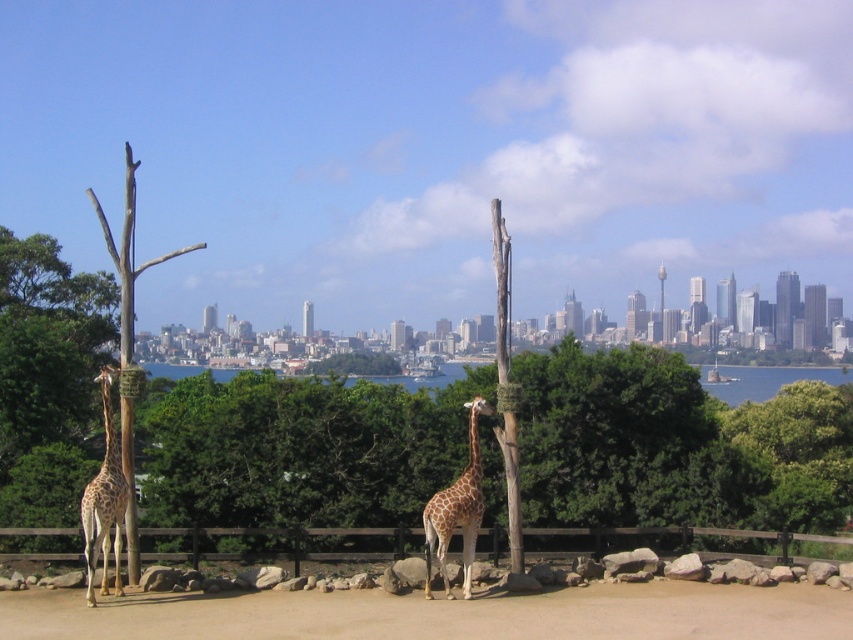
Between brown sandy dirt at center and spotted brown giraffe at center, which one has more height?

With more height is spotted brown giraffe at center.

Which is more to the right, brown sandy dirt at center or spotted brown giraffe at center?

spotted brown giraffe at center

Describe the element at coordinates (442, 614) in the screenshot. I see `brown sandy dirt at center` at that location.

Image resolution: width=853 pixels, height=640 pixels. What are the coordinates of `brown sandy dirt at center` in the screenshot? It's located at [442, 614].

Which is above, spotted fur giraffe at left or spotted brown giraffe at center?

spotted fur giraffe at left is higher up.

Does spotted fur giraffe at left come in front of spotted brown giraffe at center?

Yes, it is.

Identify the location of spotted fur giraffe at left. This screenshot has width=853, height=640. (103, 500).

Does brown sandy dirt at center have a greater height compared to brown wooden fence at center?

No.

Does brown sandy dirt at center have a greater width compared to brown wooden fence at center?

Incorrect, brown sandy dirt at center's width does not surpass brown wooden fence at center's.

Between point (212, 602) and point (206, 556), which one is positioned in front?

Point (212, 602) is more forward.

What are the coordinates of `brown sandy dirt at center` in the screenshot? It's located at click(x=442, y=614).